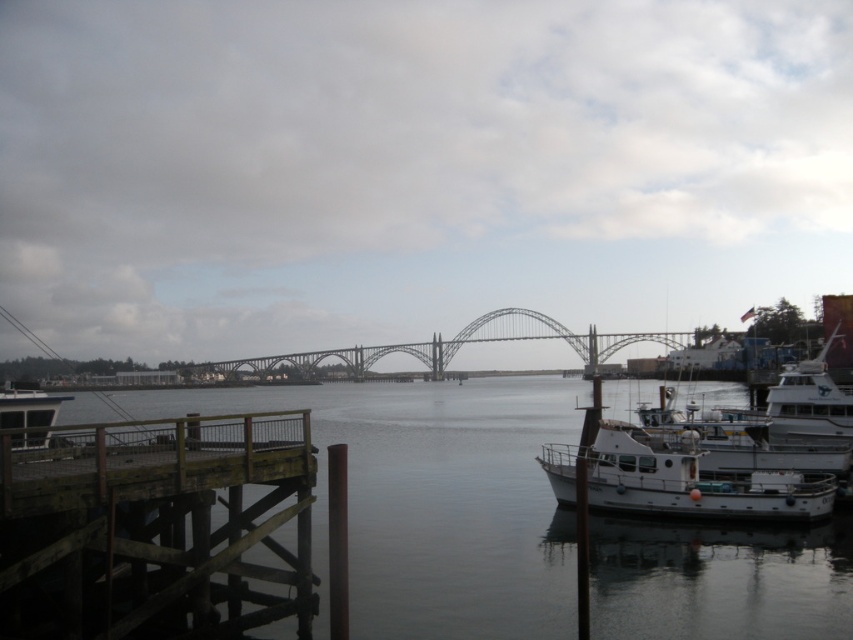
Looking at this image, you are standing on the wooden dock and want to take a photo of the metallic gray bridge at center without the white matte boat at lower right appearing in the frame. Is this possible based on their positions?

The white matte boat at lower right is in front of the metallic gray bridge at center, so it would block the view of the bridge. To take a photo of the bridge without the boat, you would need to move to a position where the boat is no longer between you and the bridge.

You are standing on the wooden dock in the foreground and want to cross to the other side of the metallic gray bridge at center. Which direction should you walk to face the smooth gray water at center?

You should walk to the right to face the smooth gray water at center since it is located to the right of the metallic gray bridge at center.